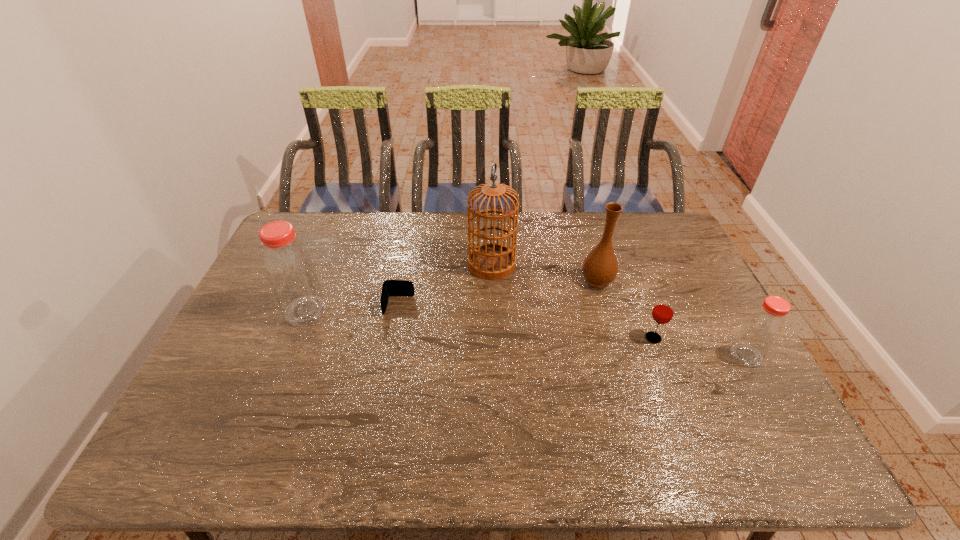
At what (x,y) coordinates should I click in order to perform the action: click on location for an additional bottle to make spacing equal. Please return your answer as a coordinate pair (x, y). The image size is (960, 540). Looking at the image, I should click on (516, 332).